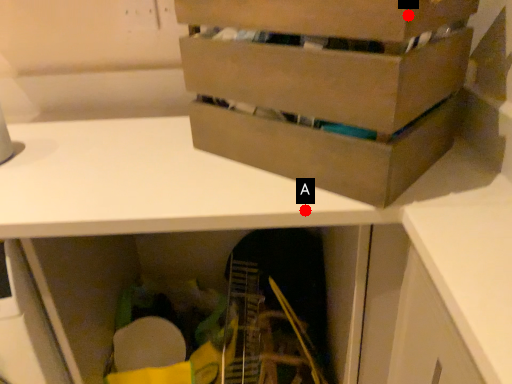
Question: Two points are circled on the image, labeled by A and B beside each circle. Which point is farther from the camera taking this photo?

Choices:
 (A) A is further
 (B) B is further

Answer: (A)